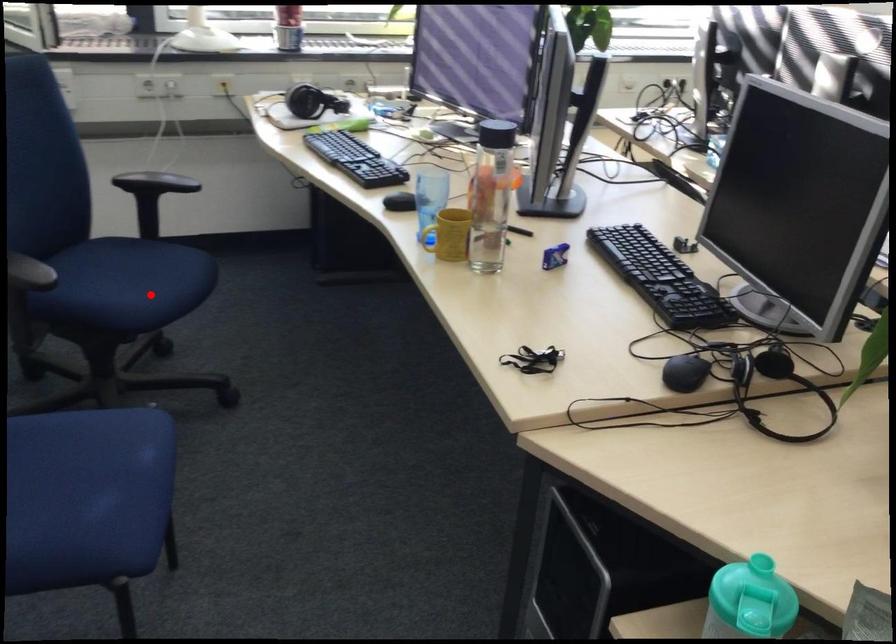
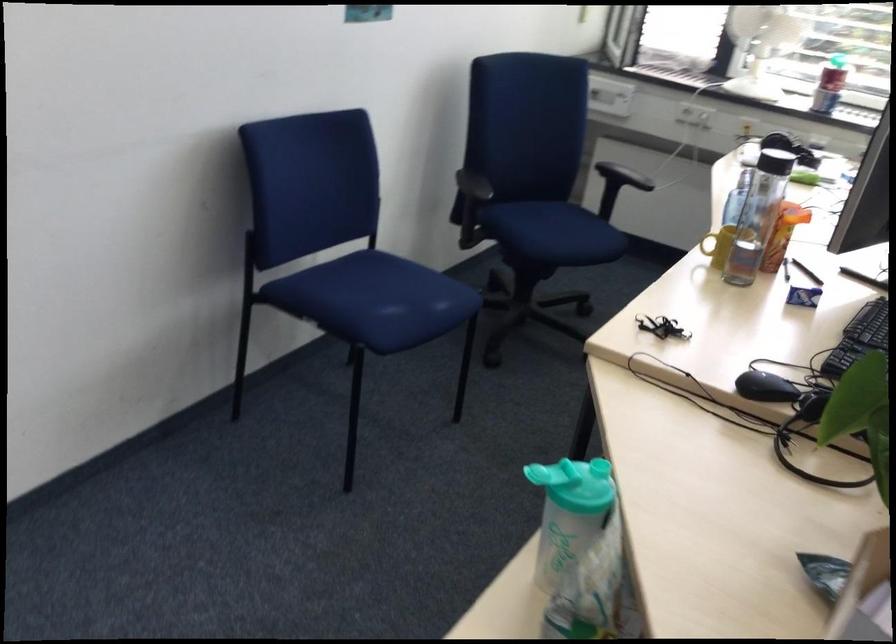
Question: I am providing you with two images of the same scene from different viewpoints. Image1 has a red point marked. In image2, the corresponding 3D location appears at what relative position? Reply with the corresponding letter.

Choices:
 (A) Closer
 (B) Farther

Answer: (B)